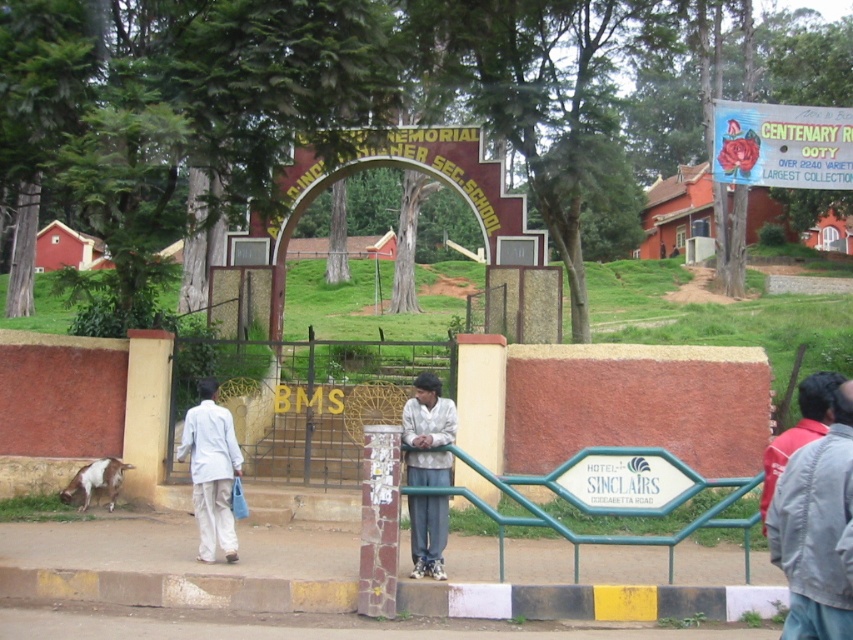
Question: Does metallic gate at center have a larger size compared to green metal railing at center?

Choices:
 (A) yes
 (B) no

Answer: (B)

Question: Does green metal railing at center appear on the right side of light beige fabric pants at center?

Choices:
 (A) no
 (B) yes

Answer: (B)

Question: From the image, what is the correct spatial relationship of green metal railing at center in relation to light beige fabric pants at center?

Choices:
 (A) below
 (B) above

Answer: (A)

Question: Among these points, which one is nearest to the camera?

Choices:
 (A) (294, 458)
 (B) (563, 529)
 (C) (846, 419)
 (D) (209, 435)

Answer: (C)

Question: Which point is closer to the camera?

Choices:
 (A) (502, 563)
 (B) (183, 476)
 (C) (437, 428)

Answer: (A)

Question: Which point is farther from the camera taking this photo?

Choices:
 (A) (195, 506)
 (B) (427, 563)
 (C) (695, 484)

Answer: (A)